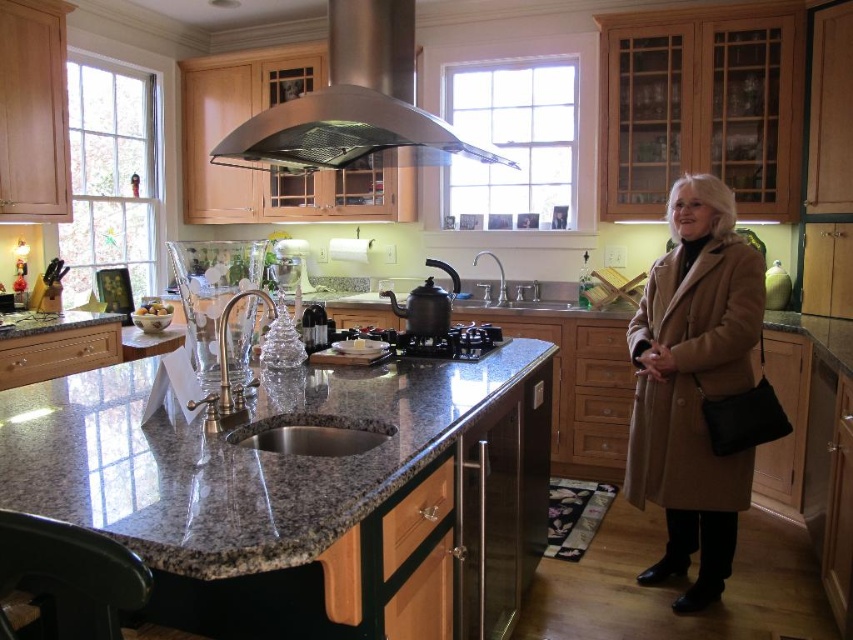
Question: Which point is farther to the camera?

Choices:
 (A) shiny metallic kettle at center
 (B) stainless steel exhaust hood at upper center
 (C) granite at center

Answer: (A)

Question: Is black glass stove at center closer to camera compared to satin nickel sink at center?

Choices:
 (A) yes
 (B) no

Answer: (A)

Question: Based on their relative distances, which object is nearer to the beige wool coat at right?

Choices:
 (A) granite at center
 (B) stainless steel exhaust hood at upper center
 (C) shiny metallic kettle at center

Answer: (A)

Question: Is the position of beige wool coat at right less distant than that of satin nickel sink at center?

Choices:
 (A) yes
 (B) no

Answer: (A)

Question: Which point appears closest to the camera in this image?

Choices:
 (A) (433, 262)
 (B) (480, 340)
 (C) (138, 371)

Answer: (C)

Question: Is stainless steel exhaust hood at upper center below satin nickel sink at center?

Choices:
 (A) no
 (B) yes

Answer: (A)